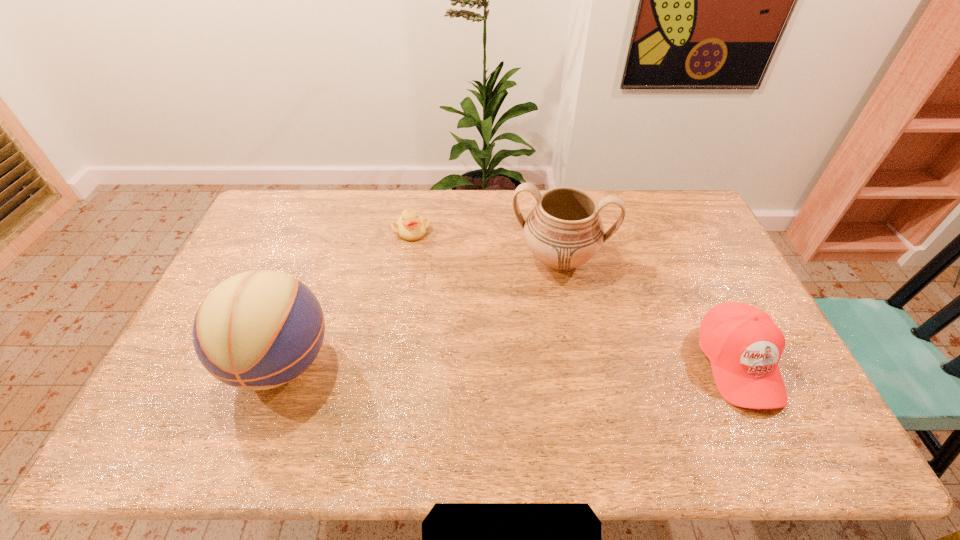
The height and width of the screenshot is (540, 960). In order to click on unoccupied position between the third tallest object and the third object from right to left in this screenshot , I will do `click(575, 297)`.

What are the coordinates of `free spot between the leftmost object and the duckling` in the screenshot? It's located at (347, 296).

You are a GUI agent. You are given a task and a screenshot of the screen. Output one action in this format:
    pyautogui.click(x=<x>, y=<y>)
    Task: Click on the object that stands as the closest to the second object from right to left
    This screenshot has height=540, width=960.
    Given the screenshot: What is the action you would take?
    pyautogui.click(x=743, y=344)

Locate which object ranks third in proximity to the basketball. Please provide its 2D coordinates. Your answer should be formatted as a tuple, i.e. [(x, y)], where the tuple contains the x and y coordinates of a point satisfying the conditions above.

[(743, 344)]